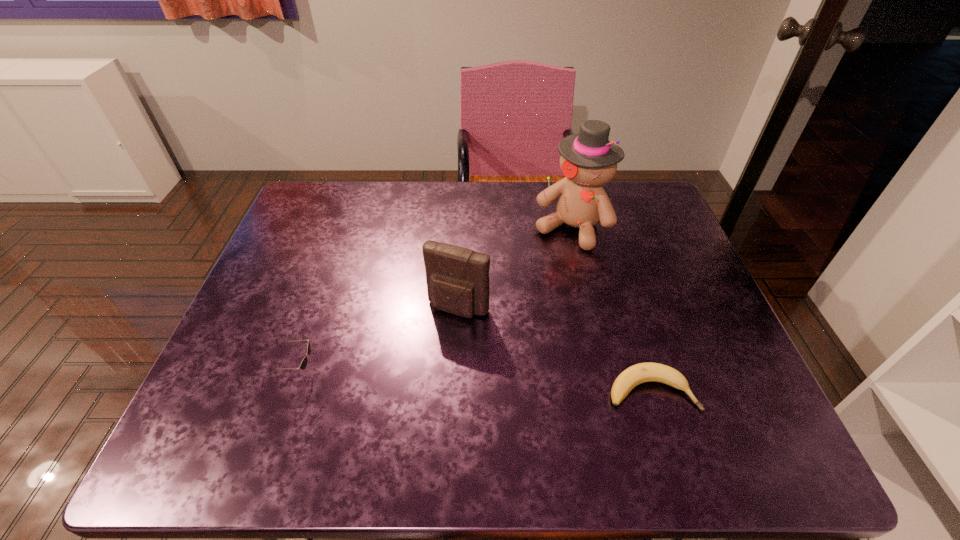
You are a GUI agent. You are given a task and a screenshot of the screen. Output one action in this format:
    pyautogui.click(x=<x>, y=<y>)
    Task: Click on the object at the near left corner
    
    Given the screenshot: What is the action you would take?
    pyautogui.click(x=303, y=364)

Find the location of a particular element. The width and height of the screenshot is (960, 540). object present at the near right corner is located at coordinates (643, 372).

The height and width of the screenshot is (540, 960). I want to click on vacant space at the far edge of the desktop, so click(x=470, y=202).

In the image, there is a desktop. At what (x,y) coordinates should I click in order to perform the action: click on vacant area at the left edge. Please return your answer as a coordinate pair (x, y). The height and width of the screenshot is (540, 960). Looking at the image, I should click on (293, 341).

Locate an element on the screen. The height and width of the screenshot is (540, 960). vacant point at the right edge is located at coordinates (653, 306).

In the image, there is a desktop. Find the location of `vacant space at the far left corner`. vacant space at the far left corner is located at coordinates (350, 186).

Locate an element on the screen. This screenshot has height=540, width=960. empty space between the rag_doll and the pouch is located at coordinates (515, 268).

Where is `free area in between the rag_doll and the banana`? free area in between the rag_doll and the banana is located at coordinates (612, 309).

The width and height of the screenshot is (960, 540). What are the coordinates of `free space between the second object from left to right and the shortest object` in the screenshot? It's located at (555, 349).

Where is `empty location between the farthest object and the shortest object`? This screenshot has width=960, height=540. empty location between the farthest object and the shortest object is located at coordinates (612, 309).